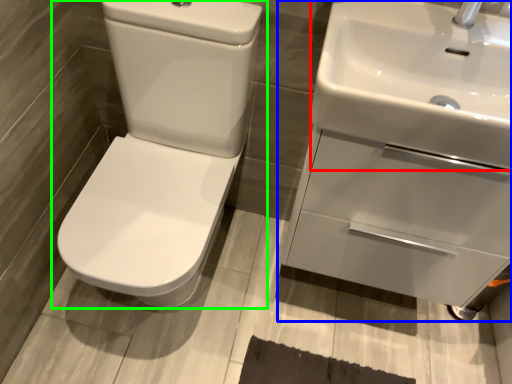
Question: Which object is the closest to the sink (highlighted by a red box)? Choose among these: sink (highlighted by a blue box) or toilet (highlighted by a green box).

Choices:
 (A) sink
 (B) toilet

Answer: (A)